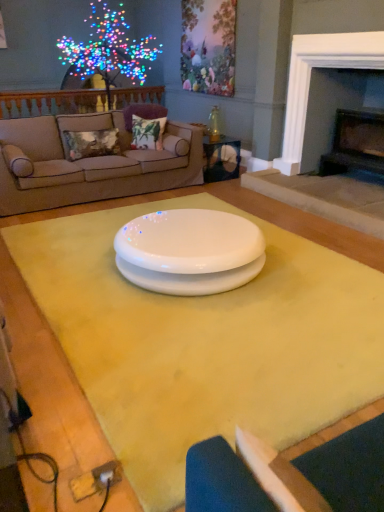
What do you see at coordinates (189, 251) in the screenshot? I see `white glossy plate at center` at bounding box center [189, 251].

The image size is (384, 512). What do you see at coordinates (339, 472) in the screenshot? I see `white fabric armchair at lower right` at bounding box center [339, 472].

In order to face illuminated plastic tree at upper left, should I rotate leftwards or rightwards?

Rotate left and turn 8.967 degrees.

Describe the element at coordinates (91, 143) in the screenshot. I see `floral fabric pillow at left, which ranks as the 1th pillow in left-to-right order` at that location.

How much space does floral fabric pillow at left, which is counted as the 2th pillow, starting from the right, occupy horizontally?

floral fabric pillow at left, which is counted as the 2th pillow, starting from the right, is 24.96 centimeters in width.

You are a GUI agent. You are given a task and a screenshot of the screen. Output one action in this format:
    pyautogui.click(x=<x>, y=<y>)
    Task: Click on the beige fabric couch at upper left
    This screenshot has width=384, height=512.
    Given the screenshot: What is the action you would take?
    pyautogui.click(x=89, y=163)

From a real-world perspective, is yellow matte table at center, the first table when ordered from front to back, on top of beige fabric couch at upper left?

No, from a real-world perspective, yellow matte table at center, the first table when ordered from front to back, is not on top of beige fabric couch at upper left.

Considering the relative sizes of yellow matte table at center, the first table when ordered from front to back, and beige fabric couch at upper left in the image provided, is yellow matte table at center, the first table when ordered from front to back, wider than beige fabric couch at upper left?

Correct, the width of yellow matte table at center, the first table when ordered from front to back, exceeds that of beige fabric couch at upper left.

Can beige fabric couch at upper left be found inside yellow matte table at center, the second table from the back?

No, beige fabric couch at upper left is not surrounded by yellow matte table at center, the second table from the back.

Considering the points (206, 197) and (27, 142), which point is behind, point (206, 197) or point (27, 142)?

The point (206, 197) is more distant.

Which is more distant, (61, 167) or (381, 167)?

The point (381, 167) is farther from the camera.

Based on their sizes in the image, would you say beige fabric couch at upper left is bigger or smaller than black stone fireplace at right, the first fireplace viewed from the right?

In the image, beige fabric couch at upper left appears to be larger than black stone fireplace at right, the first fireplace viewed from the right.

From a real-world perspective, starting from the beige fabric couch at upper left, which fireplace is the 1st one vertically above it? Please provide its 2D coordinates.

[(355, 144)]

From the picture: Can you confirm if beige fabric couch at upper left is thinner than black stone fireplace at right, which is counted as the 2th fireplace, starting from the left?

No, beige fabric couch at upper left is not thinner than black stone fireplace at right, which is counted as the 2th fireplace, starting from the left.

Is white fabric armchair at lower right bigger than velvet floral pillow at upper left, the first pillow from the right?

Actually, white fabric armchair at lower right might be smaller than velvet floral pillow at upper left, the first pillow from the right.

Measure the distance from white fabric armchair at lower right to velvet floral pillow at upper left, the second pillow positioned from the left.

They are 4.45 meters apart.

Is white fabric armchair at lower right located outside velvet floral pillow at upper left, the first pillow from the right?

That's correct, white fabric armchair at lower right is outside of velvet floral pillow at upper left, the first pillow from the right.

From a real-world perspective, is yellow matte table at center, arranged as the 1th table when ordered from the bottom, physically above black stone fireplace at right, which is counted as the 2th fireplace, starting from the left?

Incorrect, from a real-world perspective, yellow matte table at center, arranged as the 1th table when ordered from the bottom, is lower than black stone fireplace at right, which is counted as the 2th fireplace, starting from the left.

Between yellow matte table at center, the first table when ordered from front to back, and black stone fireplace at right, which is counted as the 2th fireplace, starting from the left, which one is positioned behind?

Positioned behind is black stone fireplace at right, which is counted as the 2th fireplace, starting from the left.

Which is more to the left, yellow matte table at center, the second table from the back, or black stone fireplace at right, the first fireplace viewed from the right?

Positioned to the left is yellow matte table at center, the second table from the back.

Who is smaller, yellow matte table at center, the first table when ordered from front to back, or black stone fireplace at right, the first fireplace viewed from the right?

yellow matte table at center, the first table when ordered from front to back.

Which of these two, black stone fireplace at right, which is counted as the 2th fireplace, starting from the left, or velvet floral pillow at upper left, the second pillow positioned from the left, is bigger?

Bigger between the two is black stone fireplace at right, which is counted as the 2th fireplace, starting from the left.

Does point (368, 154) appear closer or farther from the camera than point (138, 127)?

Point (368, 154) is positioned farther from the camera compared to point (138, 127).

Is black stone fireplace at right, which is counted as the 2th fireplace, starting from the left, far from velvet floral pillow at upper left, the first pillow from the right?

That's right, there is a large distance between black stone fireplace at right, which is counted as the 2th fireplace, starting from the left, and velvet floral pillow at upper left, the first pillow from the right.

Can you tell me how much black stone fireplace at right, which is counted as the 2th fireplace, starting from the left, and velvet floral pillow at upper left, the second pillow positioned from the left, differ in facing direction?

The facing directions of black stone fireplace at right, which is counted as the 2th fireplace, starting from the left, and velvet floral pillow at upper left, the second pillow positioned from the left, are 42.9 degrees apart.

Between yellow matte table at center, the second table from the back, and illuminated plastic tree at upper left, which one appears on the right side from the viewer's perspective?

From the viewer's perspective, yellow matte table at center, the second table from the back, appears more on the right side.

Is yellow matte table at center, the second table from the back, smaller than illuminated plastic tree at upper left?

Yes.

From a real-world perspective, relative to illuminated plastic tree at upper left, is yellow matte table at center, the second table from the back, vertically above or below?

In terms of real-world spatial position, yellow matte table at center, the second table from the back, is below illuminated plastic tree at upper left.

Does yellow matte table at center, the second table from the back, turn towards illuminated plastic tree at upper left?

No, yellow matte table at center, the second table from the back, is not aimed at illuminated plastic tree at upper left.

Is white fabric armchair at lower right oriented towards white glossy plate at center?

No, white fabric armchair at lower right does not turn towards white glossy plate at center.

Can you confirm if white fabric armchair at lower right is positioned to the right of white glossy plate at center?

Correct, you'll find white fabric armchair at lower right to the right of white glossy plate at center.

From the image's perspective, is white fabric armchair at lower right above or below white glossy plate at center?

From the image's perspective, white fabric armchair at lower right appears below white glossy plate at center.

Find the location of a particular element. This screenshot has height=512, width=384. the 2nd table positioned below the beige fabric couch at upper left (from a real-world perspective) is located at coordinates (204, 342).

Image resolution: width=384 pixels, height=512 pixels. In order to click on the 1st fireplace above when counting from the beige fabric couch at upper left (from the image's perspective) in this screenshot , I will do `click(355, 144)`.

Which object lies further to the anchor point white glossy table at center, positioned as the 2th table in front-to-back order, white glossy plate at center or black stone fireplace at right, which is counted as the 2th fireplace, starting from the left?

white glossy plate at center is further to white glossy table at center, positioned as the 2th table in front-to-back order.

Based on their spatial positions, is black stone fireplace at right, which is counted as the 2th fireplace, starting from the left, or illuminated plastic tree at upper left closer to beige fabric couch at upper left?

Among the two, illuminated plastic tree at upper left is located nearer to beige fabric couch at upper left.

Based on their spatial positions, is velvet floral pillow at upper left, the first pillow from the right, or yellow matte table at center, the second table from the back, closer to floral fabric pillow at left, which ranks as the 1th pillow in left-to-right order?

velvet floral pillow at upper left, the first pillow from the right.

Estimate the real-world distances between objects in this image. Which object is closer to black stone fireplace at right, which is counted as the 2th fireplace, starting from the left, yellow matte table at center, the second table from the back, or illuminated plastic tree at upper left?

Among the two, illuminated plastic tree at upper left is located nearer to black stone fireplace at right, which is counted as the 2th fireplace, starting from the left.

Looking at this image, based on their spatial positions, is floral fabric pillow at left, which is counted as the 2th pillow, starting from the right, or white glossy table at center, which is the 1th table from top to bottom, closer to white fabric armchair at lower right?

Among the two, floral fabric pillow at left, which is counted as the 2th pillow, starting from the right, is located nearer to white fabric armchair at lower right.

Estimate the real-world distances between objects in this image. Which object is closer to white glossy table at center, which is the 1th table from top to bottom, dark gray stone fireplace at upper right, arranged as the 1th fireplace when viewed from the left, or white glossy plate at center?

dark gray stone fireplace at upper right, arranged as the 1th fireplace when viewed from the left, is positioned closer to the anchor white glossy table at center, which is the 1th table from top to bottom.

When comparing their distances from white glossy table at center, which is the 1th table from top to bottom, does yellow matte table at center, the first table when ordered from front to back, or floral fabric pillow at left, which is counted as the 2th pillow, starting from the right, seem closer?

floral fabric pillow at left, which is counted as the 2th pillow, starting from the right.

From the image, which object appears to be nearer to dark gray stone fireplace at upper right, arranged as the 2th fireplace when viewed from the right, yellow matte table at center, the second table from the back, or velvet floral pillow at upper left, the second pillow positioned from the left?

velvet floral pillow at upper left, the second pillow positioned from the left.

This screenshot has width=384, height=512. Identify the location of table between white fabric armchair at lower right and dark gray stone fireplace at upper right, arranged as the 1th fireplace when viewed from the left, along the z-axis. (204, 342).

Where is `studio couch between yellow matte table at center, the 2th table positioned from the top, and white glossy table at center, marked as the first table in a back-to-front arrangement, in the front-back direction`? studio couch between yellow matte table at center, the 2th table positioned from the top, and white glossy table at center, marked as the first table in a back-to-front arrangement, in the front-back direction is located at coordinates (89, 163).

The height and width of the screenshot is (512, 384). Find the location of `studio couch between floral fabric pillow at left, which is counted as the 2th pillow, starting from the right, and white glossy table at center, marked as the first table in a back-to-front arrangement`. studio couch between floral fabric pillow at left, which is counted as the 2th pillow, starting from the right, and white glossy table at center, marked as the first table in a back-to-front arrangement is located at coordinates (89, 163).

Find the location of a particular element. This screenshot has height=512, width=384. coffee table located between white fabric armchair at lower right and velvet floral pillow at upper left, the first pillow from the right, in the depth direction is located at coordinates (189, 251).